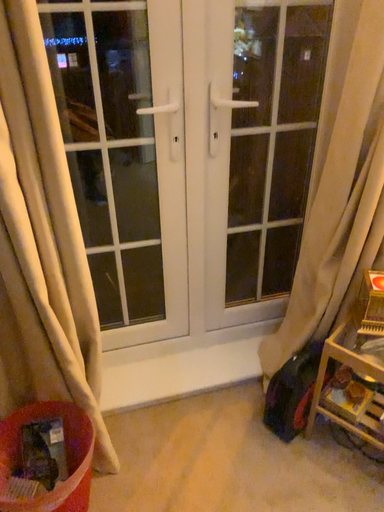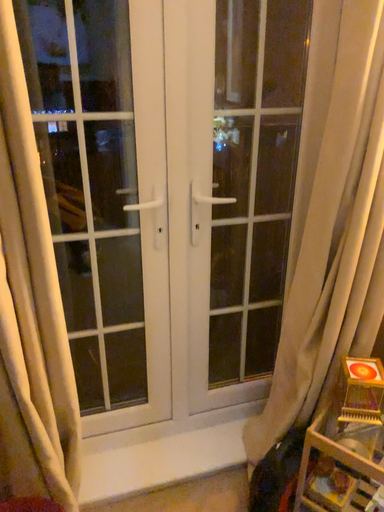
Question: How did the camera likely rotate when shooting the video?

Choices:
 (A) rotated upward
 (B) rotated downward

Answer: (A)